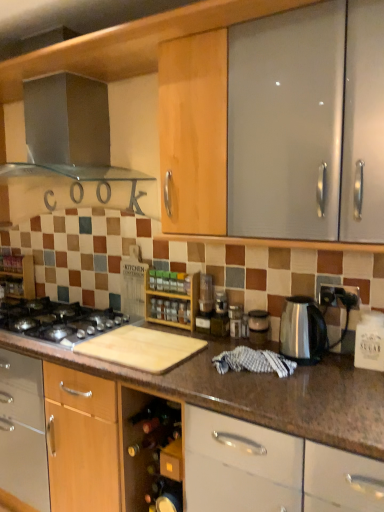
Question: Is point [x=259, y=329] closer or farther from the camera than point [x=100, y=324]?

Choices:
 (A) closer
 (B) farther

Answer: (A)

Question: Looking at their shapes, would you say transparent plastic container at center, which is counted as the 2th appliance, starting from the left, is wider or thinner than black matte gas stove at lower left?

Choices:
 (A) wide
 (B) thin

Answer: (B)

Question: Based on their relative distances, which object is farther from the stainless steel range hood at upper left, which appears as the second kitchen appliance when ordered from the bottom?

Choices:
 (A) transparent plastic container at center, which is the 1th appliance in right-to-left order
 (B) stainless steel kettle at right, which ranks as the 2th kitchen appliance in back-to-front order
 (C) wooden spice rack at left, positioned as the first shelf in back-to-front order
 (D) metallic silver blender at center, positioned as the 2th appliance in right-to-left order
 (E) black matte gas stove at lower left

Answer: (B)

Question: Considering the real-world distances, which object is closest to the black matte gas stove at lower left?

Choices:
 (A) transparent plastic container at center, which is counted as the 2th appliance, starting from the left
 (B) stainless steel kettle at right, which ranks as the 1th kitchen appliance in bottom-to-top order
 (C) wooden spice rack at center, the 2th shelf in the back-to-front sequence
 (D) wooden spice rack at left, which appears as the first shelf when viewed from the left
 (E) stainless steel range hood at upper left, acting as the second kitchen appliance starting from the right

Answer: (C)